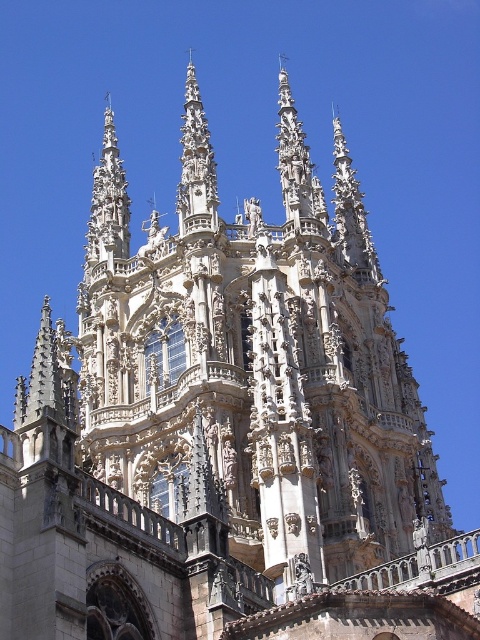
Is polished stone spire at center further to the viewer compared to carved stone spire at upper left?

No.

Is point (183, 204) closer to camera compared to point (109, 180)?

Yes.

Does point (195, 132) come farther from viewer compared to point (115, 228)?

That is False.

Locate an element on the screen. polished stone spire at center is located at coordinates tap(195, 164).